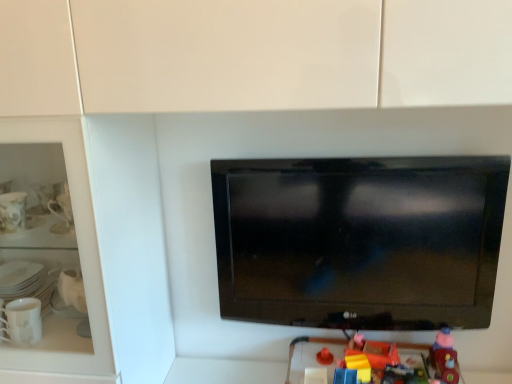
Question: From a real-world perspective, is rubberized plastic toy at lower center, which is counted as the 2th toy, starting from the right, below rubberized plastic toy at lower right, placed as the 1th toy when sorted from left to right?

Choices:
 (A) no
 (B) yes

Answer: (A)

Question: From the image's perspective, is rubberized plastic toy at lower center, which is counted as the 2th toy, starting from the right, below rubberized plastic toy at lower right, placed as the 1th toy when sorted from left to right?

Choices:
 (A) no
 (B) yes

Answer: (A)

Question: Is rubberized plastic toy at lower center, which is the second toy in left-to-right order, aimed at rubberized plastic toy at lower right, acting as the 3th toy starting from the right?

Choices:
 (A) yes
 (B) no

Answer: (B)

Question: Is rubberized plastic toy at lower center, which is counted as the 2th toy, starting from the right, not inside rubberized plastic toy at lower right, acting as the 3th toy starting from the right?

Choices:
 (A) no
 (B) yes

Answer: (A)

Question: Can you confirm if rubberized plastic toy at lower center, which is the second toy in left-to-right order, is taller than rubberized plastic toy at lower right, acting as the 3th toy starting from the right?

Choices:
 (A) yes
 (B) no

Answer: (B)

Question: Are rubberized plastic toy at lower center, which is the second toy in left-to-right order, and rubberized plastic toy at lower right, placed as the 1th toy when sorted from left to right, far apart?

Choices:
 (A) yes
 (B) no

Answer: (B)

Question: Does rubberized plastic toy at lower right, acting as the 3th toy starting from the right, have a smaller size compared to black glossy tv at center?

Choices:
 (A) yes
 (B) no

Answer: (A)

Question: Is black glossy tv at center surrounded by rubberized plastic toy at lower right, acting as the 3th toy starting from the right?

Choices:
 (A) no
 (B) yes

Answer: (A)

Question: Is rubberized plastic toy at lower right, placed as the 1th toy when sorted from left to right, touching black glossy tv at center?

Choices:
 (A) no
 (B) yes

Answer: (A)

Question: From the image's perspective, is rubberized plastic toy at lower right, acting as the 3th toy starting from the right, under black glossy tv at center?

Choices:
 (A) no
 (B) yes

Answer: (B)

Question: Considering the relative sizes of rubberized plastic toy at lower right, acting as the 3th toy starting from the right, and black glossy tv at center in the image provided, is rubberized plastic toy at lower right, acting as the 3th toy starting from the right, taller than black glossy tv at center?

Choices:
 (A) no
 (B) yes

Answer: (A)

Question: From a real-world perspective, is rubberized plastic toy at lower right, acting as the 3th toy starting from the right, located beneath black glossy tv at center?

Choices:
 (A) yes
 (B) no

Answer: (A)

Question: From a real-world perspective, is rubberized plastic toy at lower center, which is the second toy in left-to-right order, positioned under black glossy tv at center based on gravity?

Choices:
 (A) yes
 (B) no

Answer: (A)